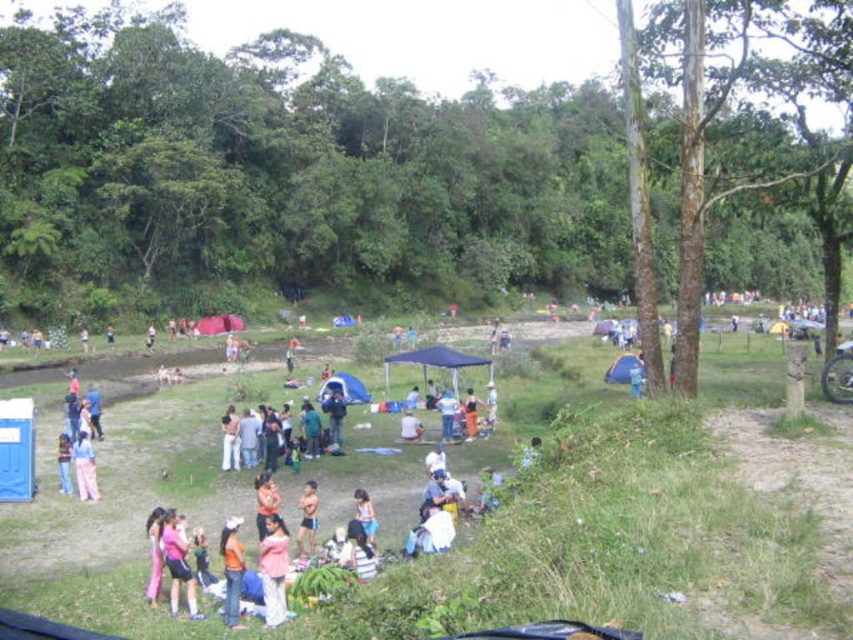
Which is behind, point (264, 592) or point (299, 524)?

Point (299, 524)

Is point (270, 554) farther from camera compared to point (305, 538)?

No, (270, 554) is in front of (305, 538).

Who is more distant from viewer, (x=263, y=582) or (x=308, y=540)?

Positioned behind is point (x=308, y=540).

Find the location of a particular element. The image size is (853, 640). pink fabric at lower center is located at coordinates (273, 570).

Who is positioned more to the left, pink fabric dress at lower left or pink fabric at center?

Positioned to the left is pink fabric dress at lower left.

Which is behind, point (171, 513) or point (312, 508)?

The point (312, 508) is behind.

What are the coordinates of `pink fabric dress at lower left` in the screenshot? It's located at (177, 563).

How much distance is there between pink fabric pants at lower left and pink fabric at center?

A distance of 5.28 meters exists between pink fabric pants at lower left and pink fabric at center.

From the picture: Between pink fabric pants at lower left and pink fabric at center, which one has less height?

With less height is pink fabric at center.

Find the location of `pink fabric pants at lower left`. pink fabric pants at lower left is located at coordinates 84,467.